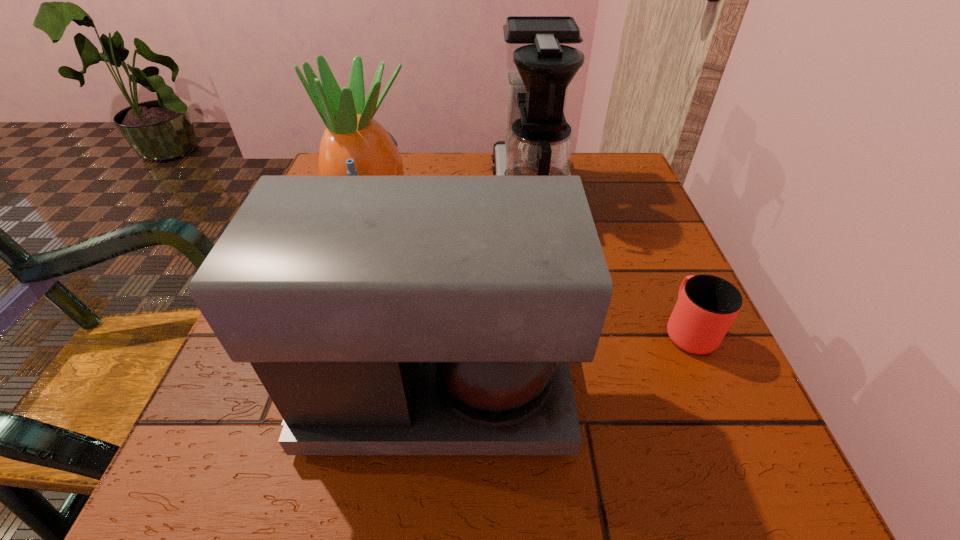
You are a GUI agent. You are given a task and a screenshot of the screen. Output one action in this format:
    pyautogui.click(x=<x>, y=<y>)
    Task: Click on the farther coffee maker
    This screenshot has width=960, height=540.
    Given the screenshot: What is the action you would take?
    pyautogui.click(x=542, y=54)

Where is `pineapple`? Image resolution: width=960 pixels, height=540 pixels. pineapple is located at coordinates (354, 143).

You are a GUI agent. You are given a task and a screenshot of the screen. Output one action in this format:
    pyautogui.click(x=<x>, y=<y>)
    Task: Click on the nearer coffee maker
    The image size is (960, 540).
    Given the screenshot: What is the action you would take?
    pyautogui.click(x=384, y=314)

Image resolution: width=960 pixels, height=540 pixels. I want to click on the shortest object, so click(707, 305).

Locate an element on the screen. The image size is (960, 540). the rightmost object is located at coordinates (707, 305).

This screenshot has width=960, height=540. I want to click on vacant space located 0.380m at the front of the farther coffee maker where the controls are located, so click(x=323, y=191).

The width and height of the screenshot is (960, 540). What are the coordinates of `free space located 0.220m at the front of the farther coffee maker where the controls are located` in the screenshot? It's located at (394, 191).

Image resolution: width=960 pixels, height=540 pixels. I want to click on free space located 0.100m at the front of the farther coffee maker where the controls are located, so click(447, 191).

Where is `vacant space located 0.350m at the entrance of the pineapple`? The width and height of the screenshot is (960, 540). vacant space located 0.350m at the entrance of the pineapple is located at coordinates (583, 213).

Find the location of a particular element. The height and width of the screenshot is (540, 960). blank area located on the carafe side of the nearer coffee maker is located at coordinates (721, 392).